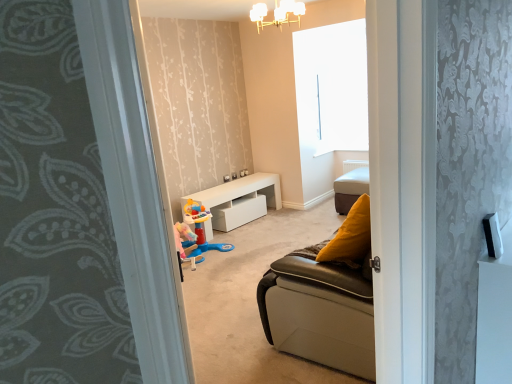
Question: Does white frosted glass chandelier at upper center appear on the right side of pastel pink plastic toy at center?

Choices:
 (A) no
 (B) yes

Answer: (B)

Question: From the image's perspective, would you say white frosted glass chandelier at upper center is shown under pastel pink plastic toy at center?

Choices:
 (A) no
 (B) yes

Answer: (A)

Question: From the image's perspective, is white frosted glass chandelier at upper center above pastel pink plastic toy at center?

Choices:
 (A) no
 (B) yes

Answer: (B)

Question: Is white frosted glass chandelier at upper center shorter than pastel pink plastic toy at center?

Choices:
 (A) no
 (B) yes

Answer: (B)

Question: Is white frosted glass chandelier at upper center to the left of pastel pink plastic toy at center from the viewer's perspective?

Choices:
 (A) no
 (B) yes

Answer: (A)

Question: Based on their positions, is leather cushion at center located to the left or right of gray floral carpet at left?

Choices:
 (A) left
 (B) right

Answer: (B)

Question: From their relative heights in the image, would you say leather cushion at center is taller or shorter than gray floral carpet at left?

Choices:
 (A) tall
 (B) short

Answer: (B)

Question: From the image's perspective, is leather cushion at center located above or below gray floral carpet at left?

Choices:
 (A) below
 (B) above

Answer: (B)

Question: Is point (344, 177) positioned closer to the camera than point (50, 190)?

Choices:
 (A) closer
 (B) farther

Answer: (B)

Question: Is leather cushion at center spatially inside pastel pink plastic toy at center, or outside of it?

Choices:
 (A) outside
 (B) inside

Answer: (A)

Question: Considering the positions of leather cushion at center and pastel pink plastic toy at center in the image, is leather cushion at center bigger or smaller than pastel pink plastic toy at center?

Choices:
 (A) small
 (B) big

Answer: (A)

Question: From the image's perspective, is leather cushion at center located above or below pastel pink plastic toy at center?

Choices:
 (A) above
 (B) below

Answer: (A)

Question: Would you say leather cushion at center is to the left or to the right of pastel pink plastic toy at center in the picture?

Choices:
 (A) right
 (B) left

Answer: (A)

Question: Considering their positions, is pastel pink plastic toy at center located in front of or behind gray floral carpet at left?

Choices:
 (A) behind
 (B) front

Answer: (A)

Question: Does point (202, 221) appear closer or farther from the camera than point (10, 87)?

Choices:
 (A) farther
 (B) closer

Answer: (A)